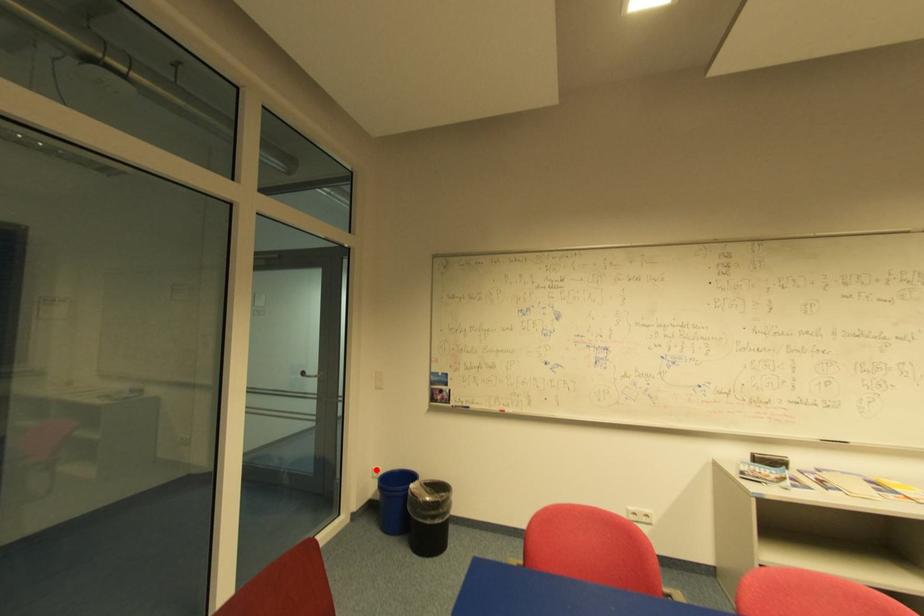
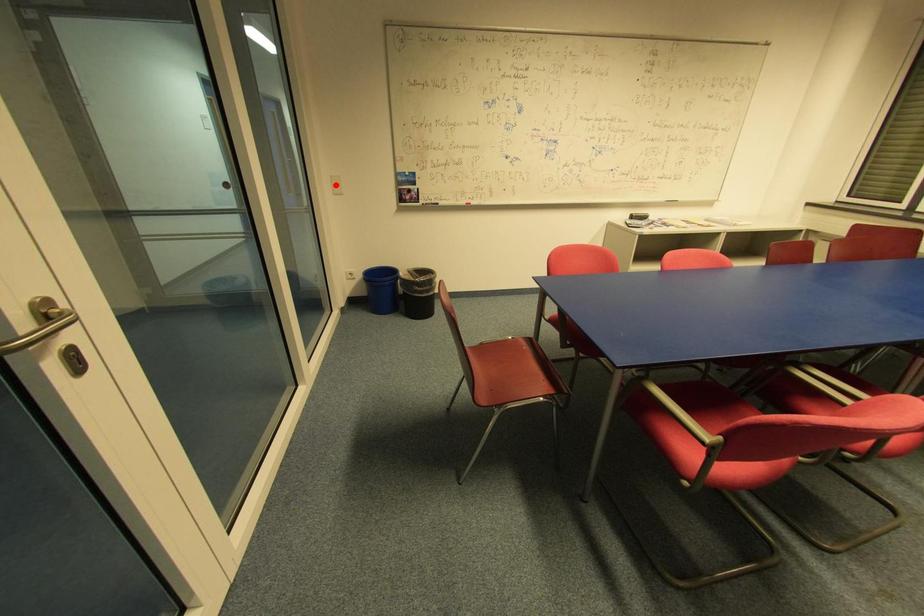
I am providing you with two images of the same scene from different viewpoints. A red point is marked on the first image and another point is marked on the second image. Does the point marked in image1 correspond to the same location as the one in image2?

No